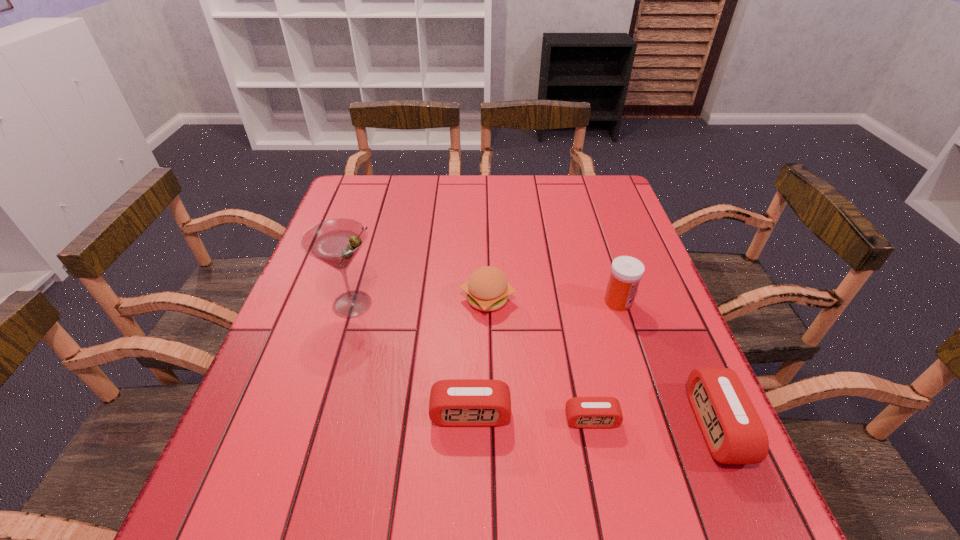
Find the location of `vacant position in the image that satisfies the following two spatial constraints: 1. on the back side of the tallest object; 2. on the left side of the hamburger`. vacant position in the image that satisfies the following two spatial constraints: 1. on the back side of the tallest object; 2. on the left side of the hamburger is located at coordinates (354, 299).

This screenshot has width=960, height=540. I want to click on free point that satisfies the following two spatial constraints: 1. on the back side of the medicine; 2. on the left side of the tallest object, so click(353, 302).